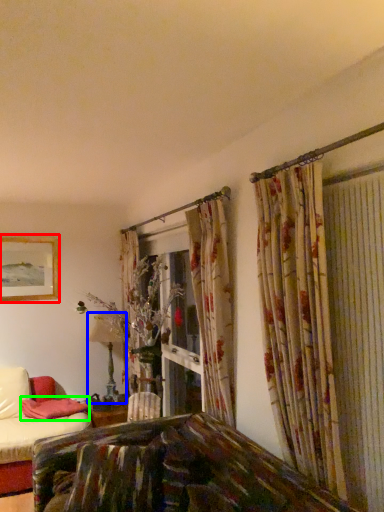
Question: Which object is the farthest from picture frame (highlighted by a red box)? Choose among these: table lamp (highlighted by a blue box) or pillow (highlighted by a green box).

Choices:
 (A) table lamp
 (B) pillow

Answer: (B)